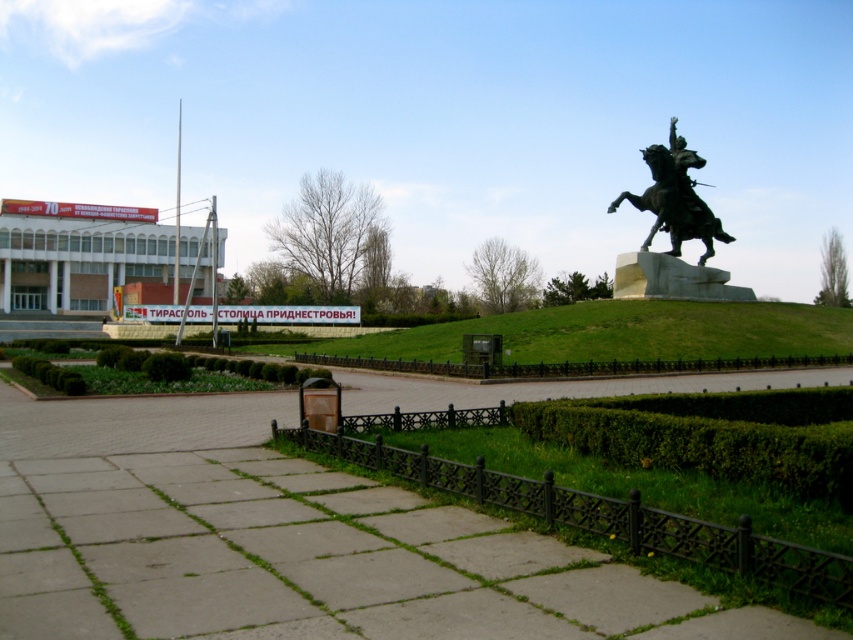
How distant is green leafy hedge at lower right from green shrubbery at lower left?

A distance of 58.04 feet exists between green leafy hedge at lower right and green shrubbery at lower left.

Does green leafy hedge at lower right have a lesser height compared to green shrubbery at lower left?

Correct, green leafy hedge at lower right is not as tall as green shrubbery at lower left.

This screenshot has width=853, height=640. Describe the element at coordinates (712, 435) in the screenshot. I see `green leafy hedge at lower right` at that location.

You are a GUI agent. You are given a task and a screenshot of the screen. Output one action in this format:
    pyautogui.click(x=<x>, y=<y>)
    Task: Click on the green leafy hedge at lower right
    This screenshot has height=640, width=853.
    Given the screenshot: What is the action you would take?
    pyautogui.click(x=712, y=435)

Is green leafy hedge at lower right positioned at the back of bronze metallic horse at upper right?

No, it is not.

Does point (692, 396) come in front of point (703, 216)?

Yes.

What do you see at coordinates (712, 435) in the screenshot? The image size is (853, 640). I see `green leafy hedge at lower right` at bounding box center [712, 435].

This screenshot has width=853, height=640. I want to click on green leafy hedge at lower right, so click(712, 435).

Can you confirm if green grass at center is positioned to the left of bronze metallic horse at upper right?

Correct, you'll find green grass at center to the left of bronze metallic horse at upper right.

The height and width of the screenshot is (640, 853). In order to click on green grass at center in this screenshot , I will do `click(264, 538)`.

Does point (177, 616) come behind point (641, 196)?

No, it is in front of (641, 196).

Find the location of a particular element. The width and height of the screenshot is (853, 640). green grass at center is located at coordinates (264, 538).